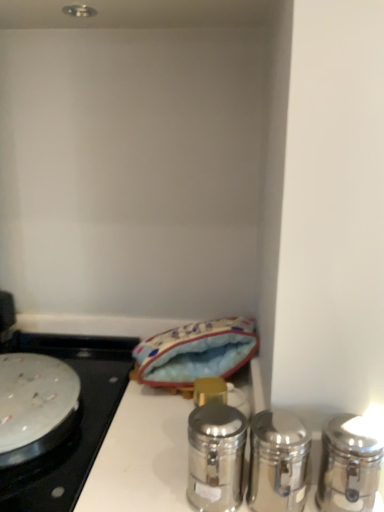
Question: Can you confirm if polished silver shaker at right, positioned as the 3th salt and pepper shakers in left-to-right order, is taller than silver metallic pan at left?

Choices:
 (A) no
 (B) yes

Answer: (B)

Question: Considering the relative sizes of polished silver shaker at right, which ranks as the 1th salt and pepper shakers in right-to-left order, and silver metallic pan at left in the image provided, is polished silver shaker at right, which ranks as the 1th salt and pepper shakers in right-to-left order, thinner than silver metallic pan at left?

Choices:
 (A) no
 (B) yes

Answer: (B)

Question: Is polished silver shaker at right, positioned as the 3th salt and pepper shakers in left-to-right order, positioned with its back to silver metallic pan at left?

Choices:
 (A) yes
 (B) no

Answer: (B)

Question: From a real-world perspective, is polished silver shaker at right, which ranks as the 1th salt and pepper shakers in right-to-left order, physically below silver metallic pan at left?

Choices:
 (A) no
 (B) yes

Answer: (A)

Question: From the image's perspective, would you say polished silver shaker at right, positioned as the 3th salt and pepper shakers in left-to-right order, is shown under silver metallic pan at left?

Choices:
 (A) yes
 (B) no

Answer: (B)

Question: From the image's perspective, is blue fabric pouch at center above or below silver metallic pan at left?

Choices:
 (A) below
 (B) above

Answer: (B)

Question: Is blue fabric pouch at center spatially inside silver metallic pan at left, or outside of it?

Choices:
 (A) inside
 (B) outside

Answer: (B)

Question: In terms of size, does blue fabric pouch at center appear bigger or smaller than silver metallic pan at left?

Choices:
 (A) big
 (B) small

Answer: (A)

Question: Is blue fabric pouch at center in front of or behind silver metallic pan at left in the image?

Choices:
 (A) front
 (B) behind

Answer: (B)

Question: In terms of size, does polished silver shaker at center, which is the 1th salt and pepper shakers from left to right, appear bigger or smaller than silver metallic pan at left?

Choices:
 (A) big
 (B) small

Answer: (B)

Question: Relative to silver metallic pan at left, is polished silver shaker at center, which is the 1th salt and pepper shakers from left to right, in front or behind?

Choices:
 (A) front
 (B) behind

Answer: (A)

Question: Is polished silver shaker at center, which is the 1th salt and pepper shakers from left to right, inside or outside of silver metallic pan at left?

Choices:
 (A) inside
 (B) outside

Answer: (B)

Question: From the image's perspective, relative to silver metallic pan at left, is polished silver shaker at center, which is the 1th salt and pepper shakers from left to right, above or below?

Choices:
 (A) below
 (B) above

Answer: (B)

Question: Looking at the image, does polished silver shaker at right, positioned as the 3th salt and pepper shakers in left-to-right order, seem bigger or smaller compared to blue fabric pouch at center?

Choices:
 (A) big
 (B) small

Answer: (B)

Question: Does point (344, 416) appear closer or farther from the camera than point (148, 371)?

Choices:
 (A) farther
 (B) closer

Answer: (B)